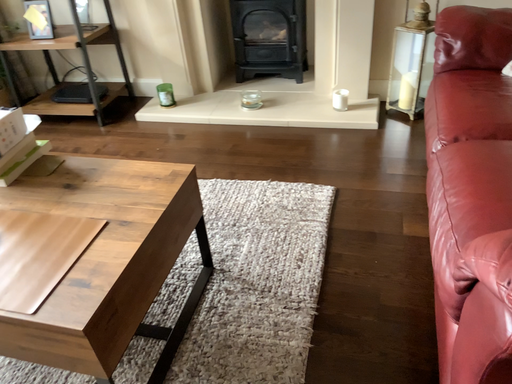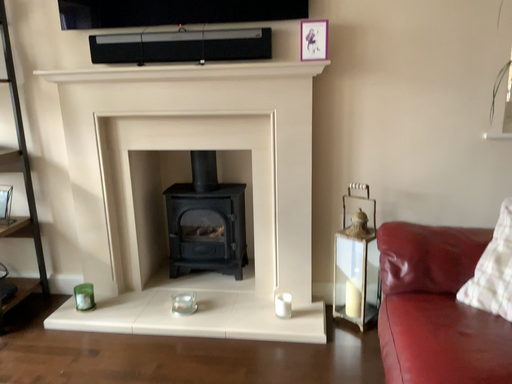
Question: Which way did the camera rotate in the video?

Choices:
 (A) rotated downward
 (B) rotated upward

Answer: (B)